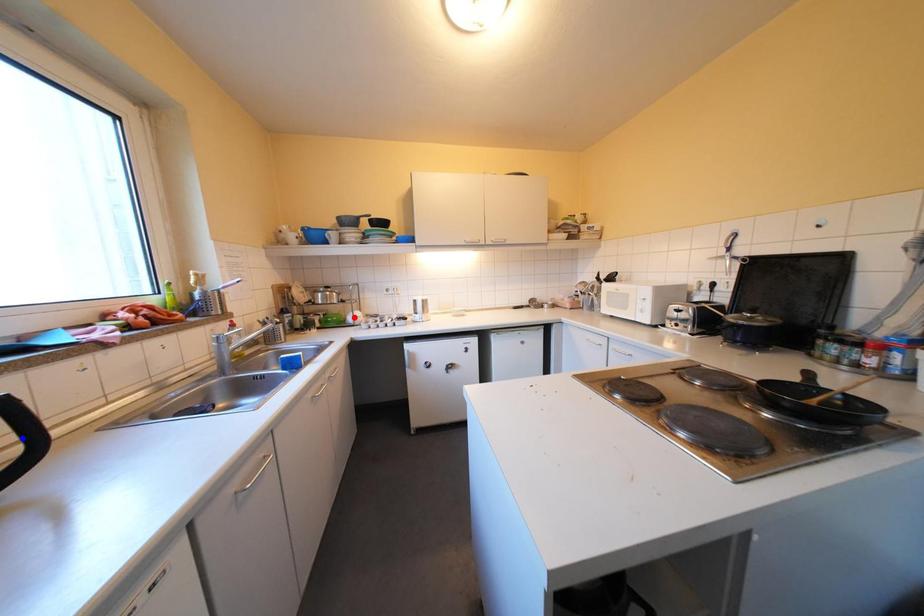
Question: Two points are marked on the image. Which point is closer to the camera?

Choices:
 (A) Blue point is closer.
 (B) Red point is closer.

Answer: (A)